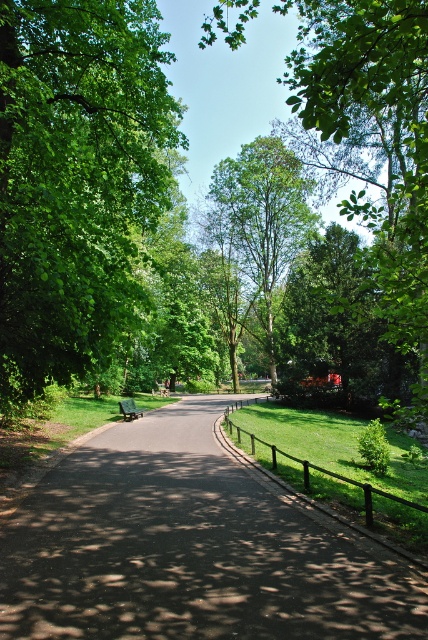
Does green leafy tree at left have a lesser width compared to green wooden bench at center?

No, green leafy tree at left is not thinner than green wooden bench at center.

Does point (50, 186) lie behind point (134, 406)?

That is False.

Where is `green leafy tree at left`? green leafy tree at left is located at coordinates (77, 179).

Is point (29, 28) behind point (270, 276)?

No, it is in front of (270, 276).

Is green leafy tree at left closer to camera compared to green leafy tree at center?

That is True.

Between point (20, 92) and point (288, 257), which one is positioned behind?

The point (288, 257) is more distant.

What are the coordinates of `green leafy tree at left` in the screenshot? It's located at (77, 179).

Does dark asphalt path at center appear on the right side of green leafy tree at center?

No, dark asphalt path at center is not to the right of green leafy tree at center.

Can you confirm if dark asphalt path at center is bigger than green leafy tree at center?

No, dark asphalt path at center is not bigger than green leafy tree at center.

Is point (208, 528) positioned after point (267, 154)?

That is False.

You are a GUI agent. You are given a task and a screenshot of the screen. Output one action in this format:
    pyautogui.click(x=<x>, y=<y>)
    Task: Click on the dark asphalt path at center
    
    Given the screenshot: What is the action you would take?
    pyautogui.click(x=190, y=548)